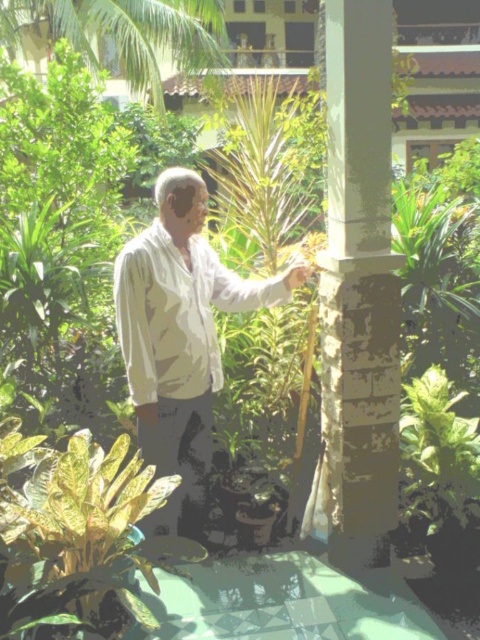
Does white matte shirt at center lie in front of white cotton shirt at center?

That is False.

In the scene shown: Is white matte shirt at center smaller than white cotton shirt at center?

Actually, white matte shirt at center might be larger than white cotton shirt at center.

Between point (165, 532) and point (156, 305), which one is positioned in front?

Point (156, 305)

Find the location of a particular element. The width and height of the screenshot is (480, 640). white matte shirt at center is located at coordinates (180, 333).

Consider the image. Between white textured pillar at center and white matte shirt at center, which one is positioned higher?

white textured pillar at center is above.

Does white textured pillar at center lie behind white matte shirt at center?

That is False.

Who is more forward, (377, 452) or (124, 292)?

Point (124, 292)

Locate an element on the screen. The image size is (480, 640). white textured pillar at center is located at coordinates (360, 288).

From the picture: Is white textured pillar at center wider than green leafy palm tree at upper left?

In fact, white textured pillar at center might be narrower than green leafy palm tree at upper left.

This screenshot has height=640, width=480. What do you see at coordinates (360, 288) in the screenshot?
I see `white textured pillar at center` at bounding box center [360, 288].

Find the location of `white textured pillar at center`. white textured pillar at center is located at coordinates (360, 288).